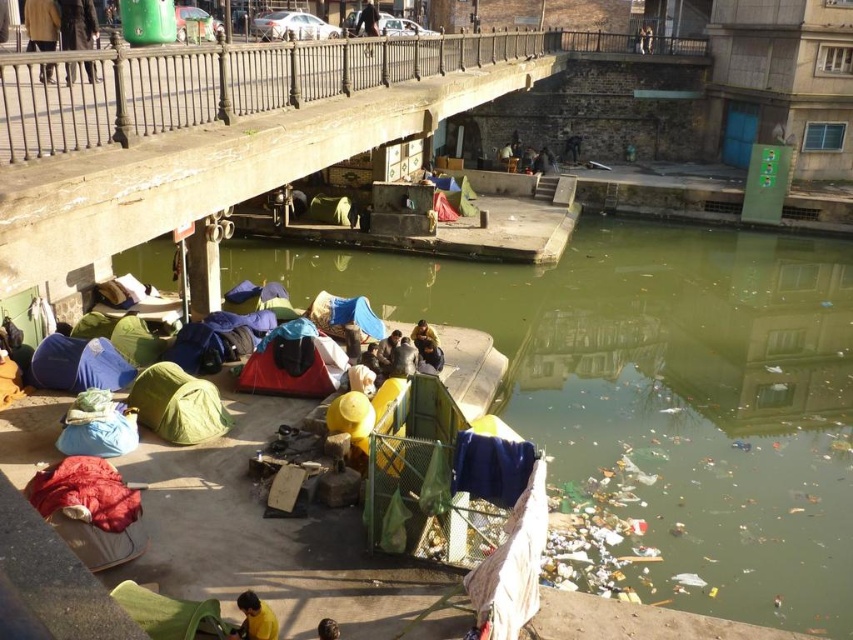
You are a delivery person who needs to place a large package on the ground near the brown leather jacket at upper left and the dark blue fabric at center. Which location has enough space to accommodate the package without overlapping other items?

The brown leather jacket at upper left has a larger size compared to dark blue fabric at center, so placing the large package near the brown leather jacket at upper left would provide more space and reduce the chance of overlapping other items.

You are a delivery person who needs to place a package between the brown leather jacket at upper left and the dark blue fabric at center. Where should you place the package?

The package should be placed between the brown leather jacket at upper left and the dark blue fabric at center, as the jacket is on the left side of the dark blue fabric.

You are a delivery person trying to navigate through the campsite to reach the rusty metal dock at center. There is a dark blue fabric at center blocking your path. Can you move around the dock to the right side to get past it?

The rusty metal dock at center is to the left of dark blue fabric at center. Therefore, you can move around to the right side of the dark blue fabric at center to bypass the obstruction and reach the dock.